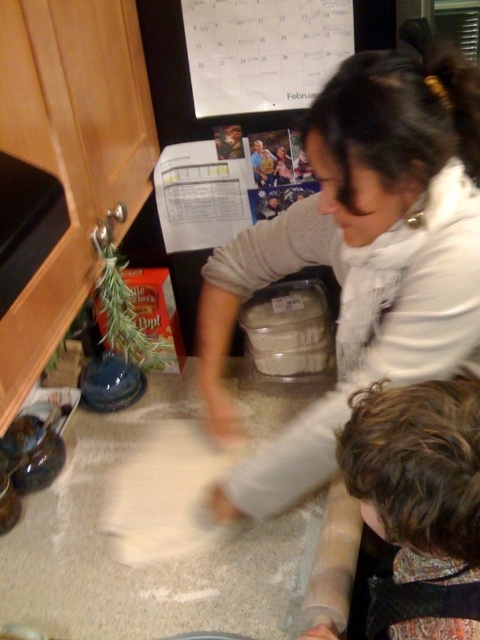
Is white textured sweater at upper center taller than curly brown hair at lower right?

Correct, white textured sweater at upper center is much taller as curly brown hair at lower right.

Is point (382, 60) positioned in front of point (398, 564)?

Yes, it is in front of point (398, 564).

This screenshot has width=480, height=640. What are the coordinates of `white textured sweater at upper center` in the screenshot? It's located at (362, 256).

Who is positioned more to the left, curly brown hair at lower right or clear plastic container at center?

From the viewer's perspective, clear plastic container at center appears more on the left side.

Which is above, curly brown hair at lower right or clear plastic container at center?

clear plastic container at center

The width and height of the screenshot is (480, 640). What do you see at coordinates (419, 502) in the screenshot?
I see `curly brown hair at lower right` at bounding box center [419, 502].

Locate an element on the screen. This screenshot has width=480, height=640. curly brown hair at lower right is located at coordinates (419, 502).

In the scene shown: Does white textured sweater at upper center appear over white paper calendar at upper center?

No, white textured sweater at upper center is not above white paper calendar at upper center.

Does white textured sweater at upper center appear under white paper calendar at upper center?

Indeed, white textured sweater at upper center is positioned under white paper calendar at upper center.

Find the location of `white textured sweater at upper center`. white textured sweater at upper center is located at coordinates (362, 256).